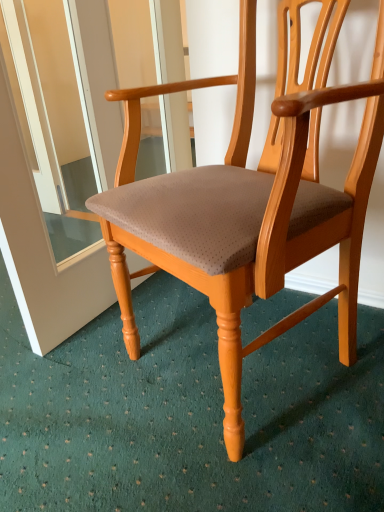
This screenshot has height=512, width=384. I want to click on free area below light brown wood chair at center (from a real-world perspective), so click(243, 384).